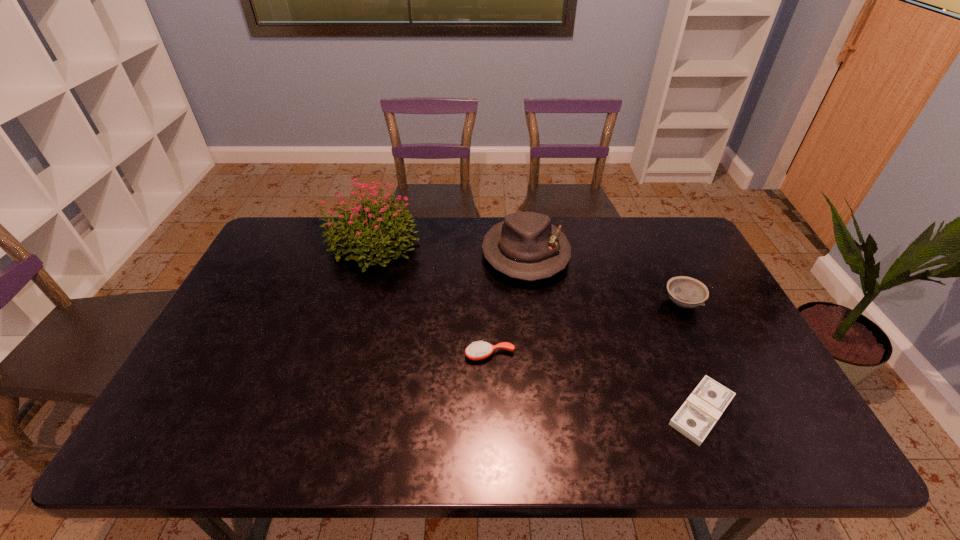
At what (x,y) coordinates should I click in order to perform the action: click on free point located 0.300m on the decorative side of the hat. Please return your answer as a coordinate pair (x, y). Looking at the image, I should click on click(540, 370).

You are a GUI agent. You are given a task and a screenshot of the screen. Output one action in this format:
    pyautogui.click(x=<x>, y=<y>)
    Task: Click on the vacant space situated on the front of the third nearest object
    This screenshot has height=540, width=960.
    Given the screenshot: What is the action you would take?
    pyautogui.click(x=718, y=379)

Identify the location of free space located on the right of the second shortest object. (553, 355).

You are a GUI agent. You are given a task and a screenshot of the screen. Output one action in this format:
    pyautogui.click(x=<x>, y=<y>)
    Task: Click on the vacant area located on the left of the nearest object
    The width and height of the screenshot is (960, 540).
    Given the screenshot: What is the action you would take?
    pyautogui.click(x=620, y=411)

This screenshot has height=540, width=960. What are the coordinates of `bouquet present at the far edge` in the screenshot? It's located at (373, 227).

This screenshot has height=540, width=960. Find the location of `hat at the far edge`. hat at the far edge is located at coordinates (526, 246).

Locate an element on the screen. The height and width of the screenshot is (540, 960). object at the near edge is located at coordinates (696, 417).

Find the location of a particular element. The width and height of the screenshot is (960, 540). bowl at the right edge is located at coordinates (686, 292).

Image resolution: width=960 pixels, height=540 pixels. What are the coordinates of `dollar present at the right edge` in the screenshot? It's located at (696, 417).

In order to click on object located in the near right corner section of the desktop in this screenshot , I will do `click(696, 417)`.